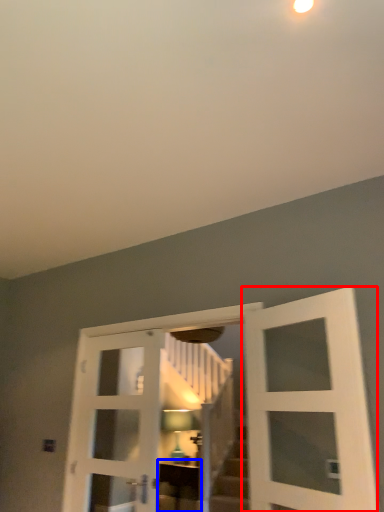
Question: Among these objects, which one is farthest to the camera, door (highlighted by a red box) or furniture (highlighted by a blue box)?

Choices:
 (A) door
 (B) furniture

Answer: (B)